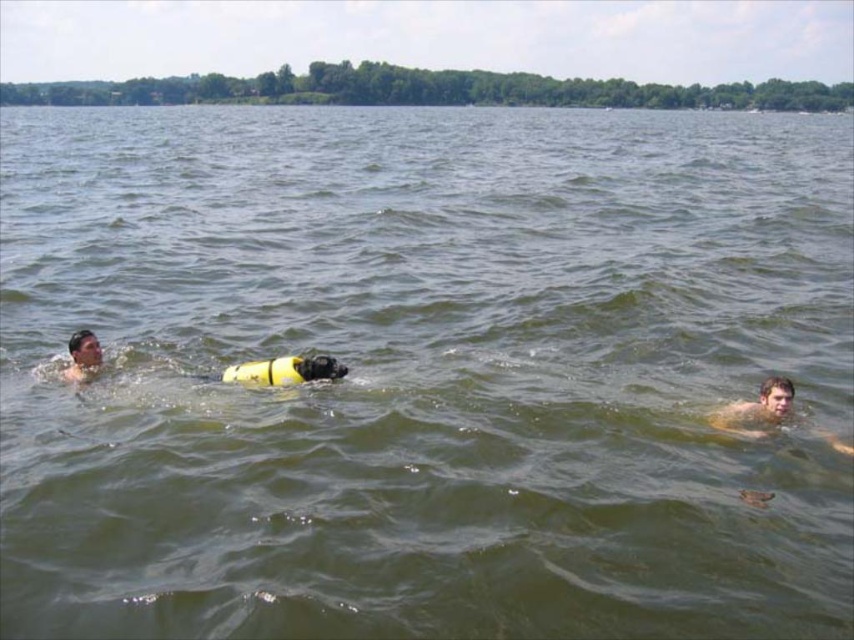
In the scene shown: You are a photographer positioned at the center of the water. You want to take a photo of both smooth skin diver at right and smooth skin diver at left. Which diver should you focus on first to ensure they are in the frame?

You should focus on the smooth skin diver at left first because they are taller than the smooth skin diver at right, making them more likely to be fully visible in the frame.

Based on the scene description and the coordinates provided, what is the significance of the point labeled at coordinates point [758,410]?

The point labeled at coordinates point [758,410] marks the location of the smooth skin diver at right.